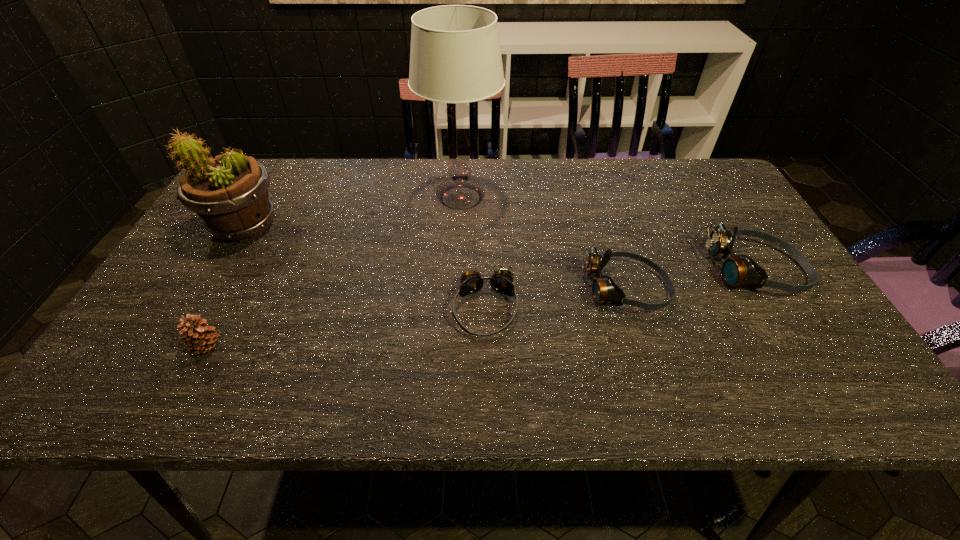
Find the location of a particular element. Image resolution: width=960 pixels, height=540 pixels. the leftmost goggles is located at coordinates (501, 281).

Locate an element on the screen. The width and height of the screenshot is (960, 540). the shortest object is located at coordinates (501, 281).

At what (x,y) coordinates should I click in order to perform the action: click on the second tallest goggles. Please return your answer as a coordinate pair (x, y). Looking at the image, I should click on (604, 290).

Locate an element on the screen. The image size is (960, 540). the second object from right to left is located at coordinates (604, 290).

Locate an element on the screen. the rightmost goggles is located at coordinates (740, 270).

At what (x,y) coordinates should I click in order to perform the action: click on flowerpot. Please return your answer as a coordinate pair (x, y). This screenshot has height=540, width=960. Looking at the image, I should click on (229, 193).

Find the location of a particular element. Image resolution: width=960 pixels, height=540 pixels. the tallest object is located at coordinates (455, 57).

At what (x,y) coordinates should I click in order to perform the action: click on pinecone. Please return your answer as a coordinate pair (x, y). The image size is (960, 540). Looking at the image, I should click on (199, 337).

The image size is (960, 540). Find the location of `free space located 0.050m through the lenses of the second shortest goggles`. free space located 0.050m through the lenses of the second shortest goggles is located at coordinates (691, 289).

Identify the location of vacant area located on the front of the fifth shortest object. (191, 318).